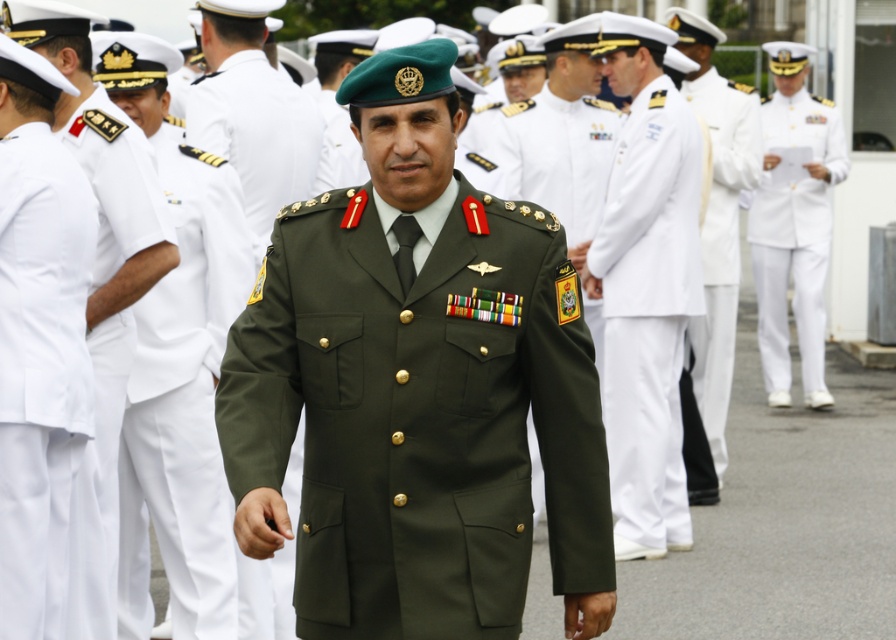
Question: Can you confirm if white cotton pants at center is positioned below white cotton uniform at center?

Choices:
 (A) no
 (B) yes

Answer: (B)

Question: In this image, where is white cotton dress uniform at left located relative to green matte beret at center?

Choices:
 (A) above
 (B) below

Answer: (B)

Question: Which of the following is the farthest from the observer?

Choices:
 (A) olive green fabric uniform at center
 (B) white cotton pants at center
 (C) green matte beret at center

Answer: (B)

Question: Which point appears farthest from the camera in this image?

Choices:
 (A) (813, 136)
 (B) (573, 340)
 (C) (9, 404)

Answer: (A)

Question: Based on their relative distances, which object is farther from the white cotton pants at center?

Choices:
 (A) white cotton uniform at center
 (B) white cotton dress uniform at right

Answer: (B)

Question: Is white cotton dress uniform at left in front of white cotton pants at left?

Choices:
 (A) yes
 (B) no

Answer: (A)